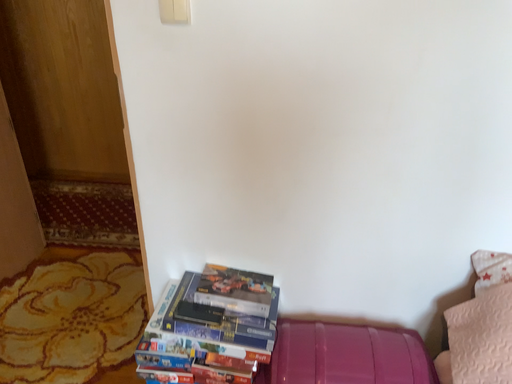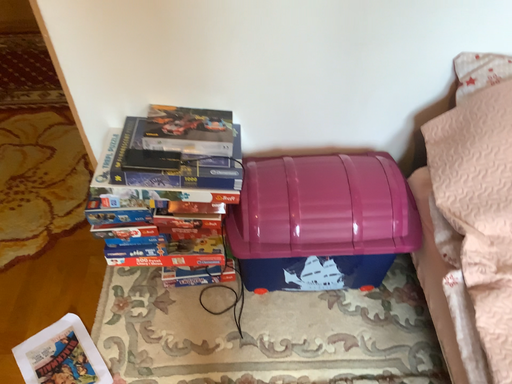
Question: Which way did the camera rotate in the video?

Choices:
 (A) rotated right
 (B) rotated left

Answer: (A)